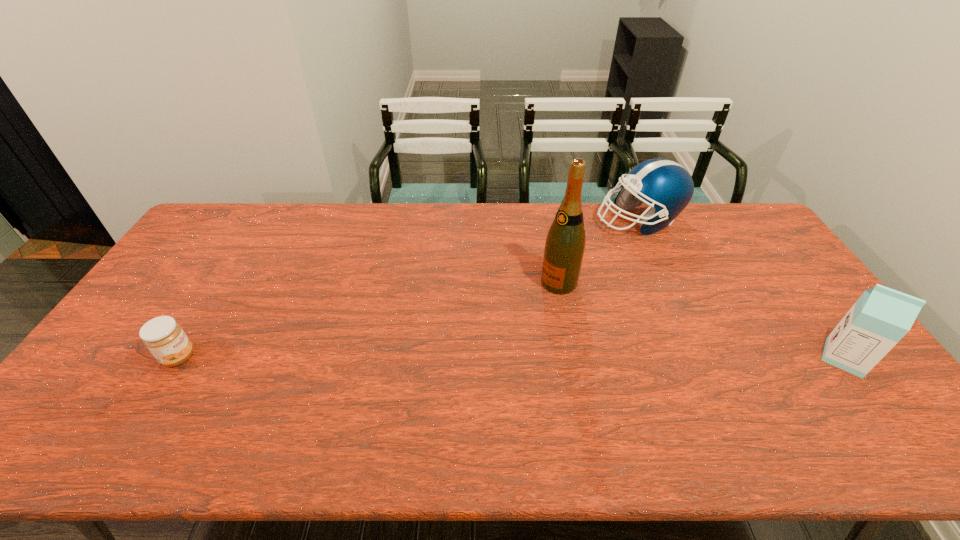
Image resolution: width=960 pixels, height=540 pixels. Find the location of `vacant spot on the desktop that is between the leftmost object and the milk carton and is positioned on the front-facing side of the third nearest object`. vacant spot on the desktop that is between the leftmost object and the milk carton and is positioned on the front-facing side of the third nearest object is located at coordinates (448, 357).

Image resolution: width=960 pixels, height=540 pixels. I want to click on free spot on the desktop that is between the leftmost object and the milk carton and is positioned at the front of the third object from left to right with the faceguard, so (551, 357).